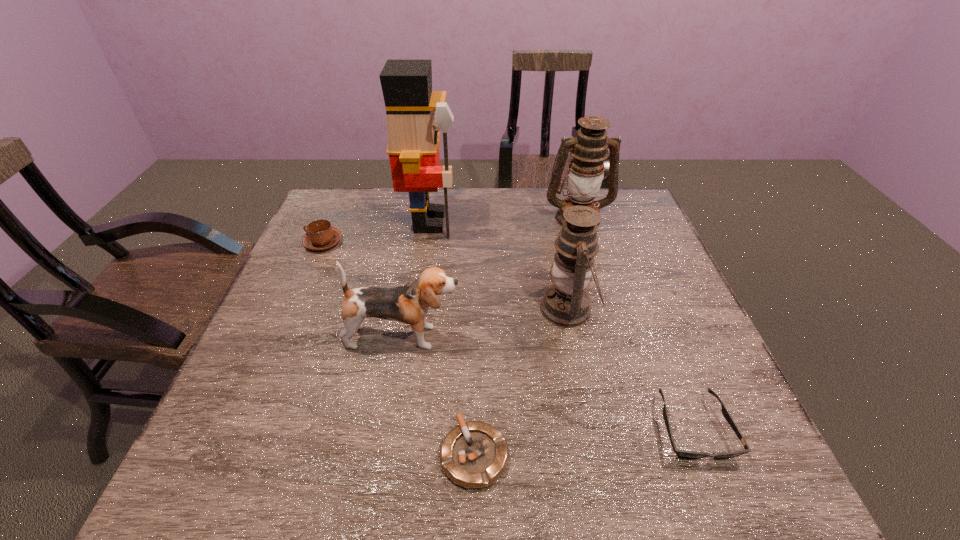
Find the location of `object that is at the far right corner`. object that is at the far right corner is located at coordinates point(589,149).

The width and height of the screenshot is (960, 540). In order to click on object at the near right corner in this screenshot , I will do [686, 454].

This screenshot has height=540, width=960. In the image, there is a desktop. Identify the location of vacant space at the far edge. (538, 224).

Where is `free space at the near edge of the desktop`? The height and width of the screenshot is (540, 960). free space at the near edge of the desktop is located at coordinates (327, 468).

At what (x,y) coordinates should I click in order to perform the action: click on vacant space at the left edge of the desktop. Please return your answer as a coordinate pair (x, y). This screenshot has height=540, width=960. Looking at the image, I should click on (256, 406).

In the image, there is a desktop. Identify the location of vacant region at the right edge. This screenshot has width=960, height=540. (684, 310).

The width and height of the screenshot is (960, 540). I want to click on vacant point at the near left corner, so click(266, 457).

Where is `free space at the far right corner`? This screenshot has height=540, width=960. free space at the far right corner is located at coordinates (628, 190).

This screenshot has height=540, width=960. Find the location of `vacant area that lies between the ashtray and the sunglasses`. vacant area that lies between the ashtray and the sunglasses is located at coordinates (584, 441).

Where is `free space between the fourth shortest object and the farther oil lamp`? free space between the fourth shortest object and the farther oil lamp is located at coordinates (491, 278).